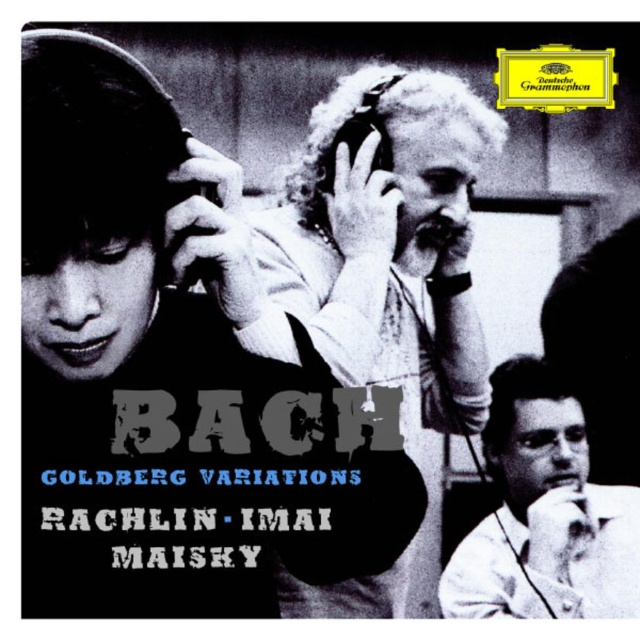
Is point (348, 160) more distant than point (488, 592)?

No.

Between white curly hair at upper center and white smooth shirt at lower right, which one is positioned higher?

white curly hair at upper center is higher up.

Does point (420, 305) come behind point (577, 490)?

That is False.

The height and width of the screenshot is (640, 640). I want to click on white curly hair at upper center, so click(x=388, y=289).